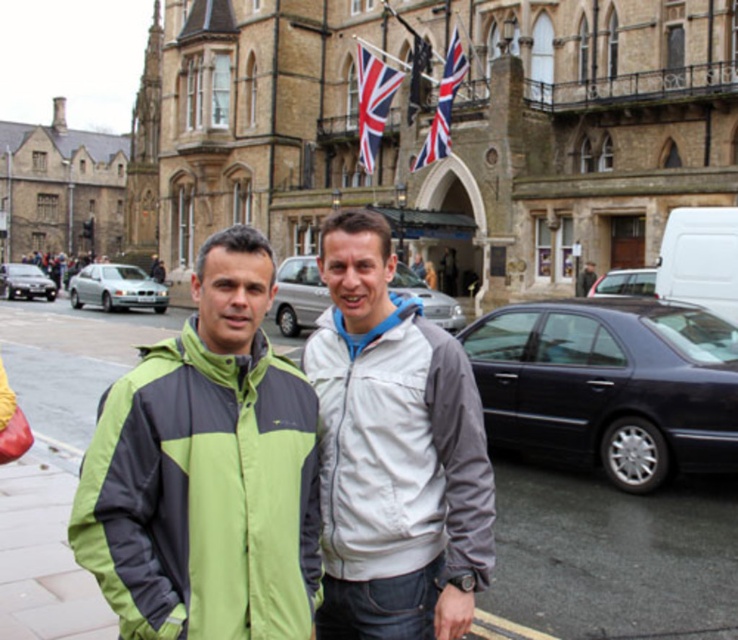
Question: Which point is farther to the camera?

Choices:
 (A) green fabric jacket at left
 (B) light gray fabric jacket at center

Answer: (B)

Question: Can you confirm if shiny black sedan at right is smaller than silver metallic sedan at center?

Choices:
 (A) yes
 (B) no

Answer: (A)

Question: Which is nearer to the green fabric jacket at left?

Choices:
 (A) silver metallic sedan at center
 (B) silver metallic sedan at left
 (C) union jack fabric flag at upper center
 (D) shiny silver sedan at center

Answer: (A)

Question: Is silver metallic sedan at center further to camera compared to blue fabric flag at upper center?

Choices:
 (A) yes
 (B) no

Answer: (B)

Question: Which object is positioned farthest from the light gray fabric jacket at center?

Choices:
 (A) union jack fabric flag at upper center
 (B) red fabric flag at upper center
 (C) green fabric jacket at center
 (D) blue fabric flag at upper center

Answer: (A)

Question: Is satin silver metallic sedan at left above union jack fabric flag at upper center?

Choices:
 (A) yes
 (B) no

Answer: (B)